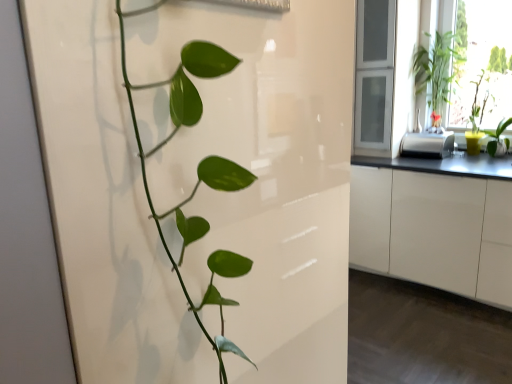
Question: From their relative heights in the image, would you say white glossy cabinetry at right is taller or shorter than clear glass window frame at upper right?

Choices:
 (A) short
 (B) tall

Answer: (A)

Question: Is point [x=451, y=193] positioned closer to the camera than point [x=390, y=120]?

Choices:
 (A) closer
 (B) farther

Answer: (A)

Question: Considering the real-world distances, which object is farthest from the green leafy plant at upper right?

Choices:
 (A) green glossy plant at right, marked as the 4th houseplant in a left-to-right arrangement
 (B) yellow matte pot at right, acting as the 3th houseplant starting from the left
 (C) satin silver toaster at right
 (D) clear glass window frame at upper right
 (E) green glossy plant at upper right, the 2th houseplant positioned from the left

Answer: (D)

Question: Which of these objects is positioned farthest from the green leafy plant at upper right?

Choices:
 (A) clear glass window frame at upper right
 (B) satin silver toaster at right
 (C) green glossy plant at right, the 1th houseplant from the right
 (D) green glossy plant at left, the 1th houseplant positioned from the left
 (E) white glossy cabinetry at right

Answer: (D)